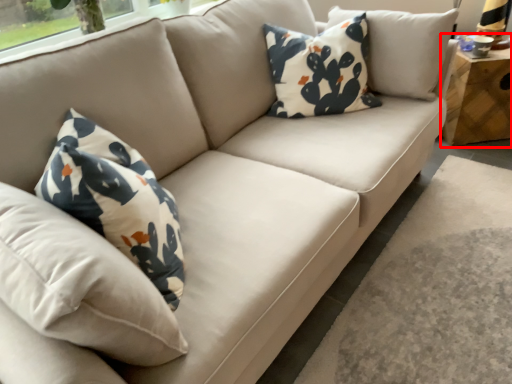
Question: From the image's perspective, where is table (annotated by the red box) located relative to pillow?

Choices:
 (A) below
 (B) above

Answer: (B)